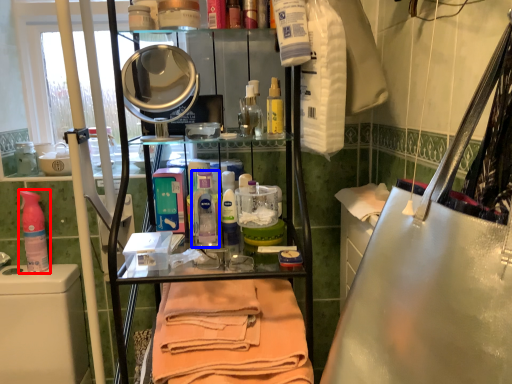
Question: Which object is closer to the camera taking this photo, cleaning product (highlighted by a red box) or cleaning product (highlighted by a blue box)?

Choices:
 (A) cleaning product
 (B) cleaning product

Answer: (B)